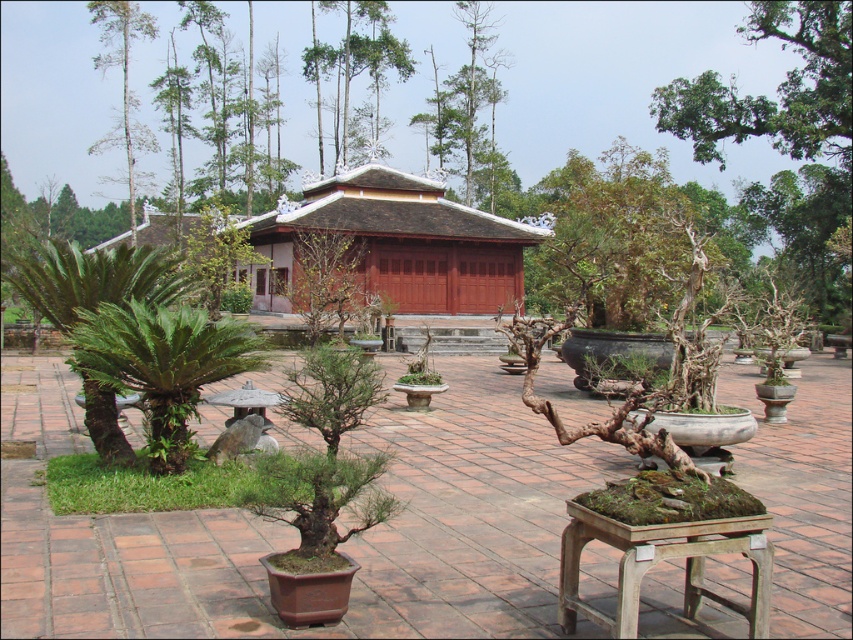
Based on the photo, does brown clay pot at center have a greater height compared to smooth bark tree at upper left?

No.

Is brown clay pot at center shorter than smooth bark tree at upper left?

Indeed, brown clay pot at center has a lesser height compared to smooth bark tree at upper left.

What do you see at coordinates (296, 532) in the screenshot? The width and height of the screenshot is (853, 640). I see `brown clay pot at center` at bounding box center [296, 532].

Image resolution: width=853 pixels, height=640 pixels. Find the location of `brown clay pot at center`. brown clay pot at center is located at coordinates (296, 532).

Is point (497, 449) more distant than point (289, 225)?

No, it is in front of (289, 225).

Which is below, brown clay pot at center or matte wood hut at center?

brown clay pot at center is below.

Identify the location of brown clay pot at center. This screenshot has width=853, height=640. (296, 532).

Is point (735, 120) farther from camera compared to point (86, 8)?

No.

What do you see at coordinates (776, 90) in the screenshot?
I see `green leafy tree at upper right` at bounding box center [776, 90].

At what (x,y) coordinates should I click in order to perform the action: click on green leafy tree at upper right. Please return your answer as a coordinate pair (x, y). Looking at the image, I should click on (776, 90).